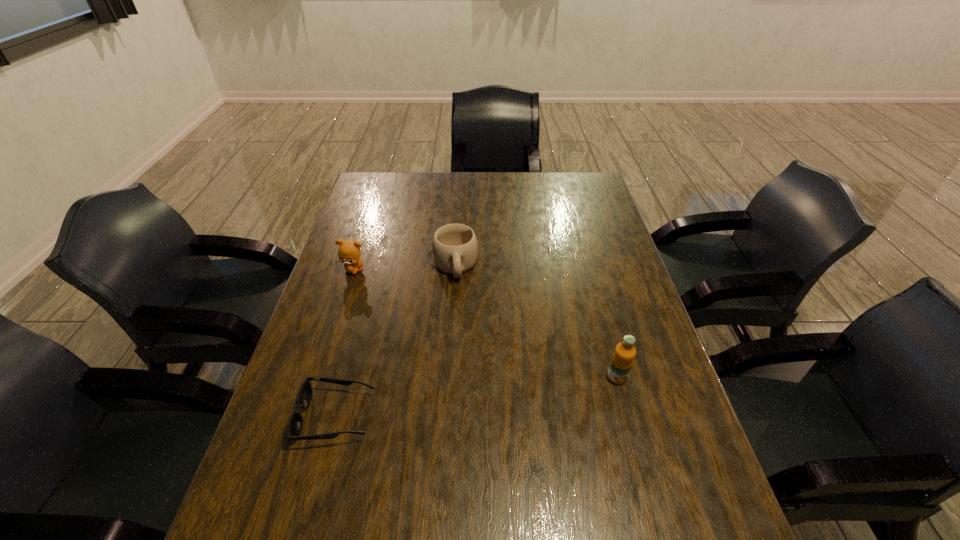
This screenshot has width=960, height=540. In order to click on free area in between the teddy bear and the third farthest object in this screenshot , I will do `click(486, 323)`.

Identify the location of vacant area that lies between the nearest object and the teddy bear. This screenshot has height=540, width=960. (345, 343).

Identify the location of free point between the nearest object and the teddy bear. (345, 343).

I want to click on free spot between the tallest object and the second object from right to left, so click(537, 322).

You are a GUI agent. You are given a task and a screenshot of the screen. Output one action in this format:
    pyautogui.click(x=<x>, y=<y>)
    Task: Click on the free spot between the nearest object and the third farthest object
    This screenshot has width=960, height=540.
    Given the screenshot: What is the action you would take?
    pyautogui.click(x=476, y=397)

You are a GUI agent. You are given a task and a screenshot of the screen. Output one action in this format:
    pyautogui.click(x=<x>, y=<y>)
    Task: Click on the free space between the teddy bear and the third object from left to right
    This screenshot has width=960, height=540.
    Given the screenshot: What is the action you would take?
    pyautogui.click(x=405, y=268)

This screenshot has width=960, height=540. Identify the location of vacant area between the second nearest object and the shortest object. (476, 397).

Identify the location of blank region between the teddy bear and the second object from right to left. (405, 268).

This screenshot has width=960, height=540. In order to click on free spot between the sunglasses and the third object from left to right in this screenshot , I will do `click(396, 341)`.

You are a GUI agent. You are given a task and a screenshot of the screen. Output one action in this format:
    pyautogui.click(x=<x>, y=<y>)
    Task: Click on the free space between the mug and the tallest object
    The height and width of the screenshot is (540, 960).
    Given the screenshot: What is the action you would take?
    pyautogui.click(x=537, y=322)